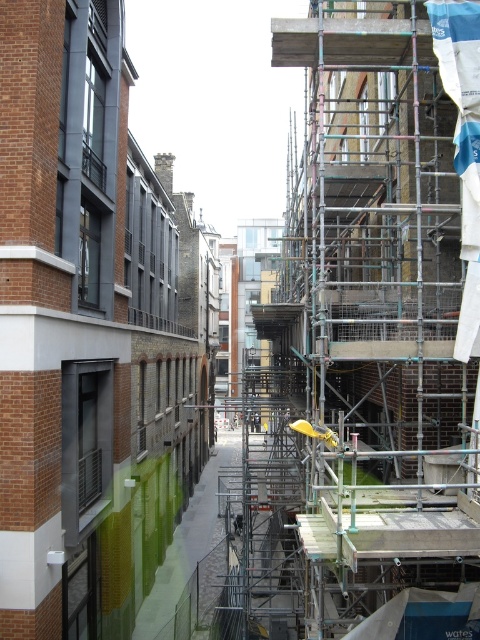
Question: In this image, where is green matte wall at center located relative to metal scaffolding at center?

Choices:
 (A) below
 (B) above

Answer: (A)

Question: Is green matte wall at center above metal scaffolding at center?

Choices:
 (A) yes
 (B) no

Answer: (B)

Question: Which point is closer to the camera?

Choices:
 (A) green matte wall at center
 (B) metal scaffolding at center

Answer: (B)

Question: Can you confirm if green matte wall at center is bigger than metal scaffolding at center?

Choices:
 (A) no
 (B) yes

Answer: (B)